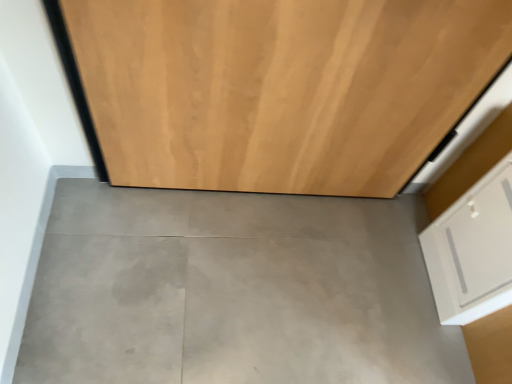
At what (x,y) coordinates should I click in order to perform the action: click on vacant region to the left of white matte drawer at lower right. Please return your answer as a coordinate pair (x, y). The image size is (512, 384). Looking at the image, I should click on (391, 253).